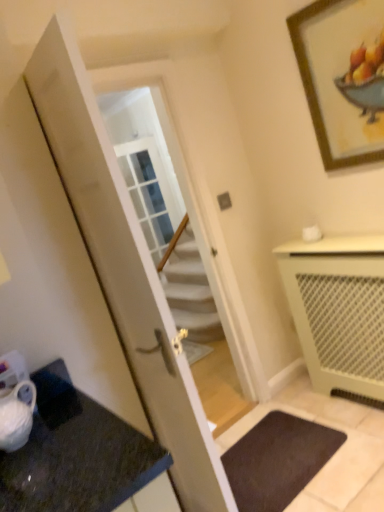
This screenshot has height=512, width=384. Identify the location of vacant area that lies between beige mesh radiator at lower right and dark brown carpet at lower center. (327, 442).